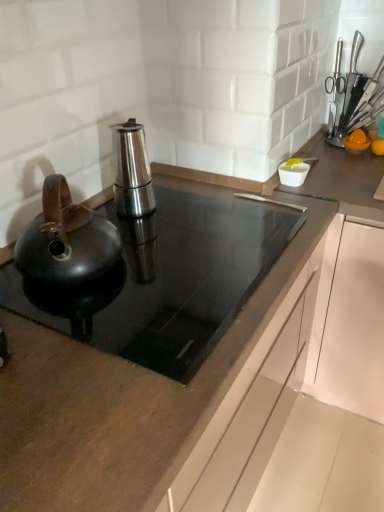
Question: Is stainless steel espresso maker at center, positioned as the second kitchen appliance in front-to-back order, looking in the opposite direction of black glass cooktop at center?

Choices:
 (A) no
 (B) yes

Answer: (A)

Question: Is stainless steel espresso maker at center, which is the 1th kitchen appliance in back-to-front order, far away from black glass cooktop at center?

Choices:
 (A) yes
 (B) no

Answer: (B)

Question: Is stainless steel espresso maker at center, which is the 1th kitchen appliance in back-to-front order, facing towards black glass cooktop at center?

Choices:
 (A) yes
 (B) no

Answer: (B)

Question: Does stainless steel espresso maker at center, positioned as the second kitchen appliance in front-to-back order, have a larger size compared to black glass cooktop at center?

Choices:
 (A) yes
 (B) no

Answer: (B)

Question: From the image's perspective, is stainless steel espresso maker at center, positioned as the second kitchen appliance in front-to-back order, located above black glass cooktop at center?

Choices:
 (A) yes
 (B) no

Answer: (A)

Question: Does stainless steel espresso maker at center, positioned as the second kitchen appliance in front-to-back order, have a greater height compared to black glass cooktop at center?

Choices:
 (A) no
 (B) yes

Answer: (B)

Question: Can you confirm if metallic knife block at upper right is bigger than black glass cooktop at center?

Choices:
 (A) no
 (B) yes

Answer: (A)

Question: Is metallic knife block at upper right to the left of black glass cooktop at center from the viewer's perspective?

Choices:
 (A) no
 (B) yes

Answer: (A)

Question: Is there a large distance between metallic knife block at upper right and black glass cooktop at center?

Choices:
 (A) yes
 (B) no

Answer: (B)

Question: Could you tell me if metallic knife block at upper right is facing black glass cooktop at center?

Choices:
 (A) no
 (B) yes

Answer: (B)

Question: Considering the relative sizes of metallic knife block at upper right and black glass cooktop at center in the image provided, is metallic knife block at upper right thinner than black glass cooktop at center?

Choices:
 (A) yes
 (B) no

Answer: (A)

Question: From a real-world perspective, is metallic knife block at upper right positioned over black glass cooktop at center based on gravity?

Choices:
 (A) no
 (B) yes

Answer: (B)

Question: From a real-world perspective, is stainless steel espresso maker at center, which is the 1th kitchen appliance in back-to-front order, positioned over shiny black kettle at left, marked as the first kitchen appliance in a front-to-back arrangement, based on gravity?

Choices:
 (A) no
 (B) yes

Answer: (B)